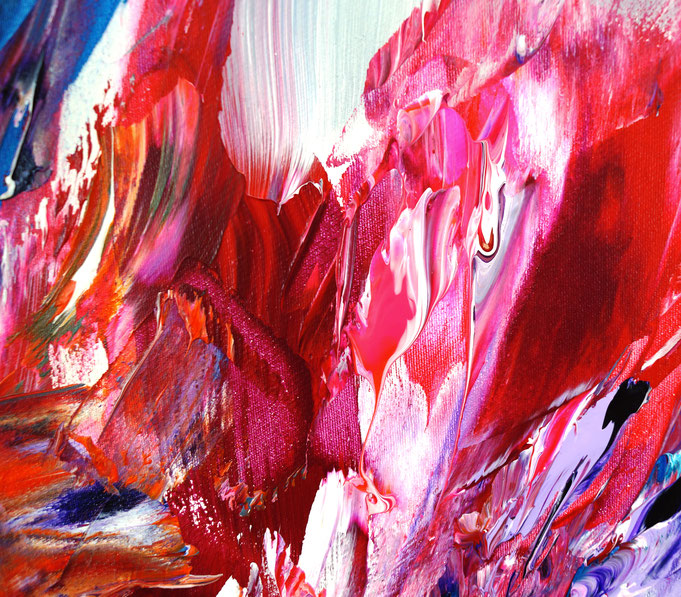
Identify the location of white paint. (338, 39).